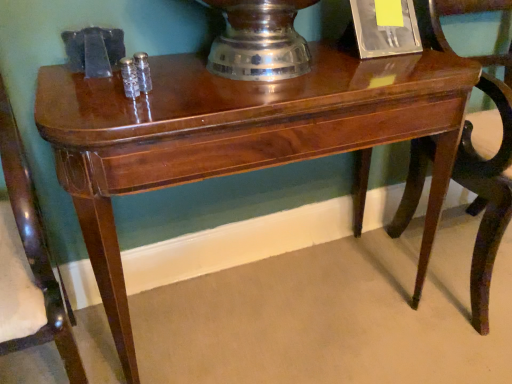
Question: From a real-world perspective, relative to mahogany wood chair at right, acting as the first chair starting from the right, is mahogany wood chair at left, which is the 2th chair from right to left, vertically above or below?

Choices:
 (A) above
 (B) below

Answer: (A)

Question: Which is correct: mahogany wood chair at left, the first chair from the left, is inside mahogany wood chair at right, arranged as the 2th chair when viewed from the left, or outside of it?

Choices:
 (A) inside
 (B) outside

Answer: (B)

Question: Is mahogany wood chair at left, the first chair from the left, wider or thinner than mahogany wood chair at right, arranged as the 2th chair when viewed from the left?

Choices:
 (A) thin
 (B) wide

Answer: (A)

Question: From their relative heights in the image, would you say mahogany wood chair at right, acting as the first chair starting from the right, is taller or shorter than mahogany wood chair at left, the first chair from the left?

Choices:
 (A) short
 (B) tall

Answer: (A)

Question: Looking at their shapes, would you say mahogany wood chair at right, arranged as the 2th chair when viewed from the left, is wider or thinner than mahogany wood chair at left, the first chair from the left?

Choices:
 (A) wide
 (B) thin

Answer: (A)

Question: Considering the positions of point (487, 316) and point (11, 216), is point (487, 316) closer or farther from the camera than point (11, 216)?

Choices:
 (A) farther
 (B) closer

Answer: (A)

Question: Is mahogany wood chair at right, acting as the first chair starting from the right, to the left or to the right of mahogany wood chair at left, which is the 2th chair from right to left, in the image?

Choices:
 (A) left
 (B) right

Answer: (B)